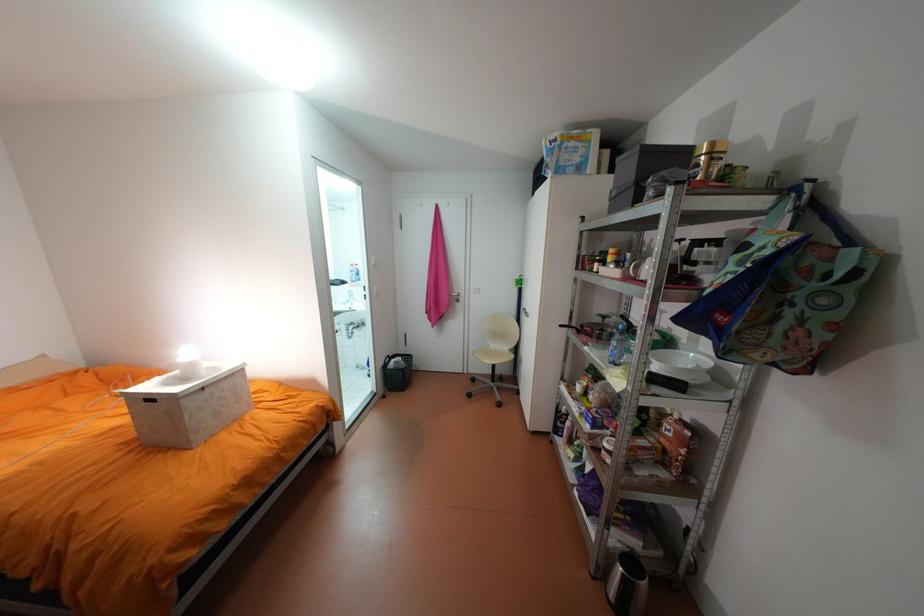
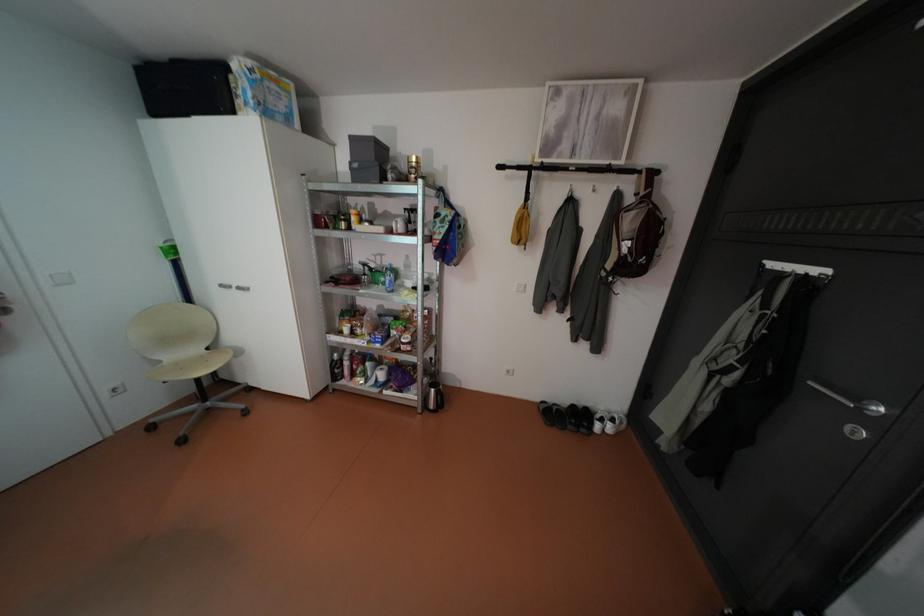
Find the pixel in the second image that matches point 585,159 in the first image.

(290, 107)